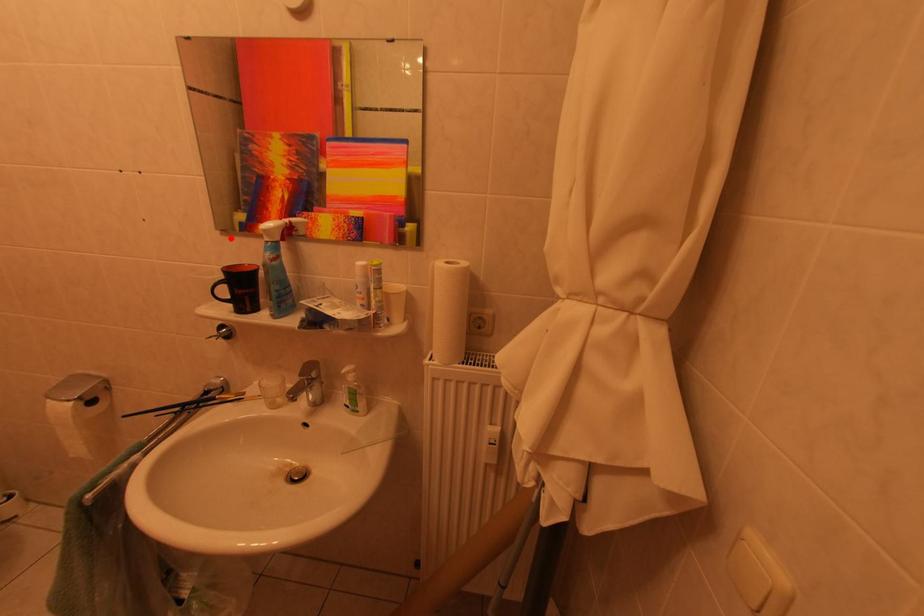
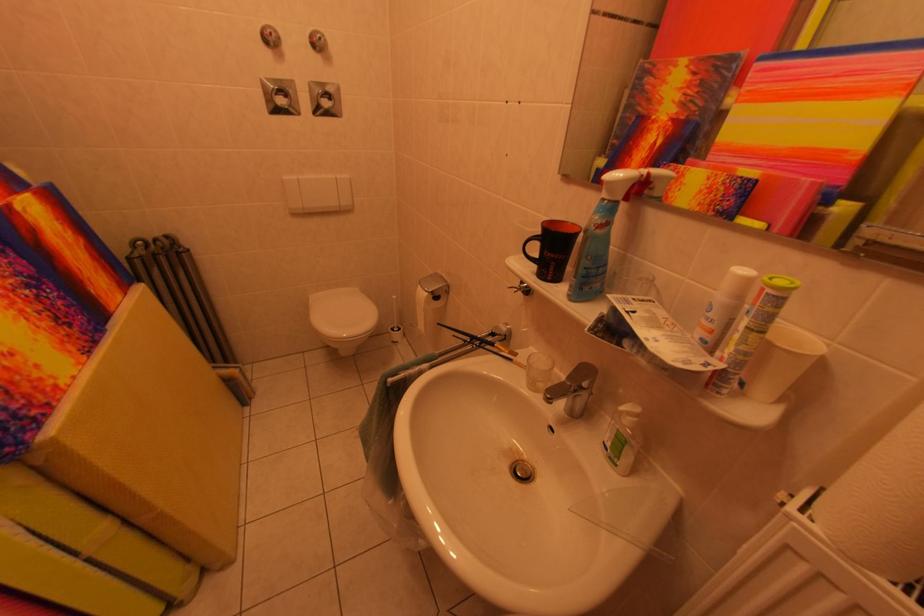
Locate, in the second image, the point that corresponds to the highlighted location in the first image.

(569, 184)